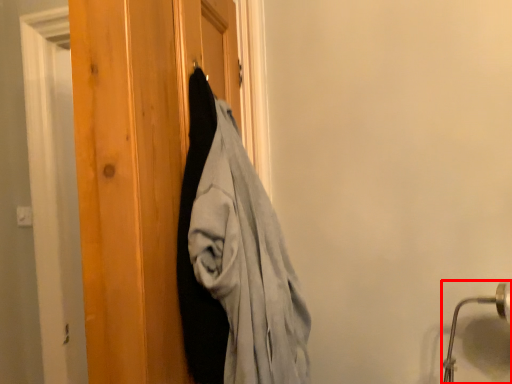
Question: From the image, what is the correct spatial relationship of door handle (annotated by the red box) in relation to barn door?

Choices:
 (A) right
 (B) left

Answer: (A)